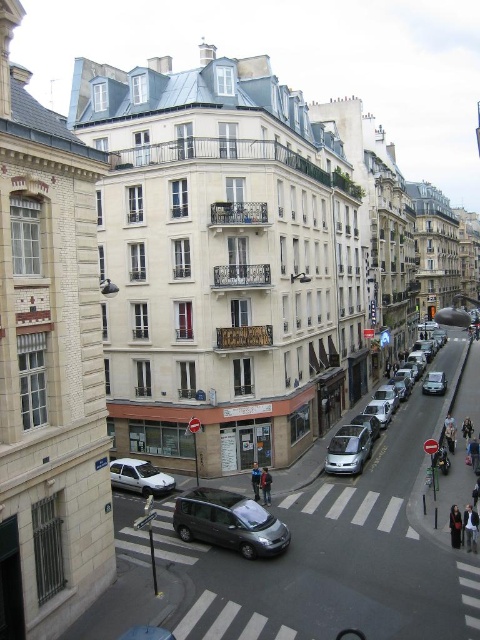
Who is positioned more to the right, metallic gray minivan at center or silver metallic car at center-right?

silver metallic car at center-right is more to the right.

Between metallic gray minivan at center and silver metallic car at center-right, which one is positioned lower?

metallic gray minivan at center is lower down.

Which is in front, point (274, 548) or point (432, 390)?

Point (274, 548) is in front.

At what (x,y) coordinates should I click in order to perform the action: click on metallic gray minivan at center. Please return your answer as a coordinate pair (x, y). Looking at the image, I should click on (228, 522).

Who is higher up, metallic silver van at center or satin silver car at center?

satin silver car at center is above.

Who is more distant from viewer, [206,602] or [343,436]?

Positioned behind is point [343,436].

The height and width of the screenshot is (640, 480). What are the coordinates of `metallic silver van at center` in the screenshot? It's located at (336, 560).

Between satin silver car at center and dark blue jacket at center, which one appears on the left side from the viewer's perspective?

dark blue jacket at center is more to the left.

Does point (371, 451) come behind point (260, 486)?

Yes.

This screenshot has height=640, width=480. What are the coordinates of `satin silver car at center` in the screenshot? It's located at (348, 451).